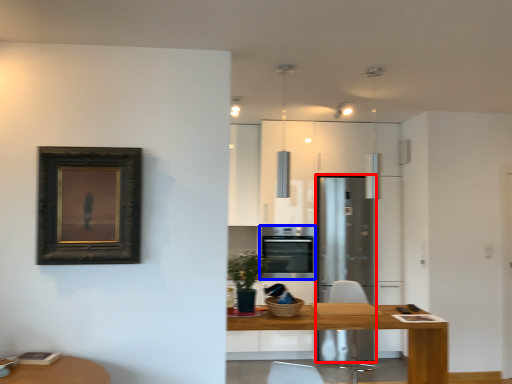
Question: Which object appears closest to the camera in this image, fridge (highlighted by a red box) or oven (highlighted by a blue box)?

Choices:
 (A) fridge
 (B) oven

Answer: (A)